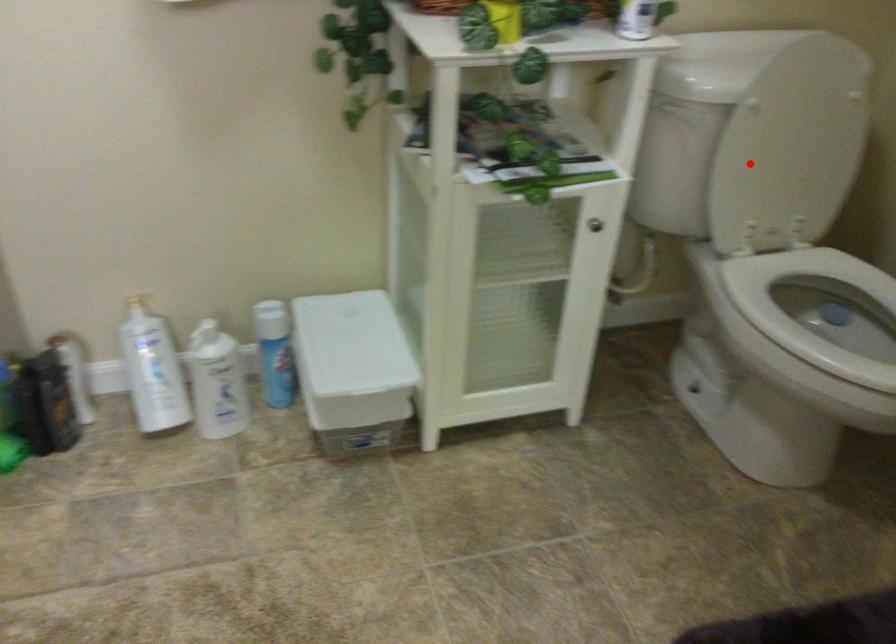
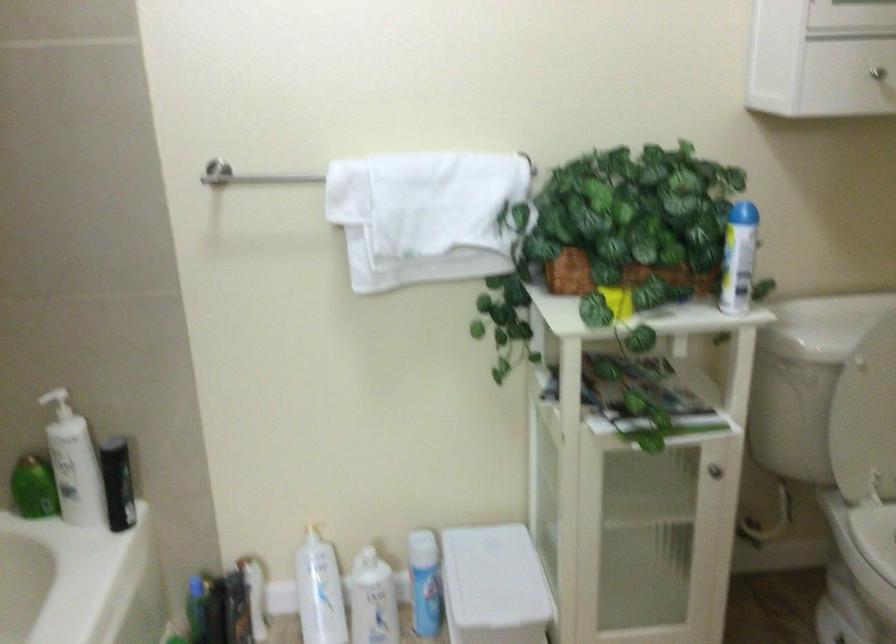
Where in the second image is the point corresponding to the highlighted location from the first image?

(865, 413)